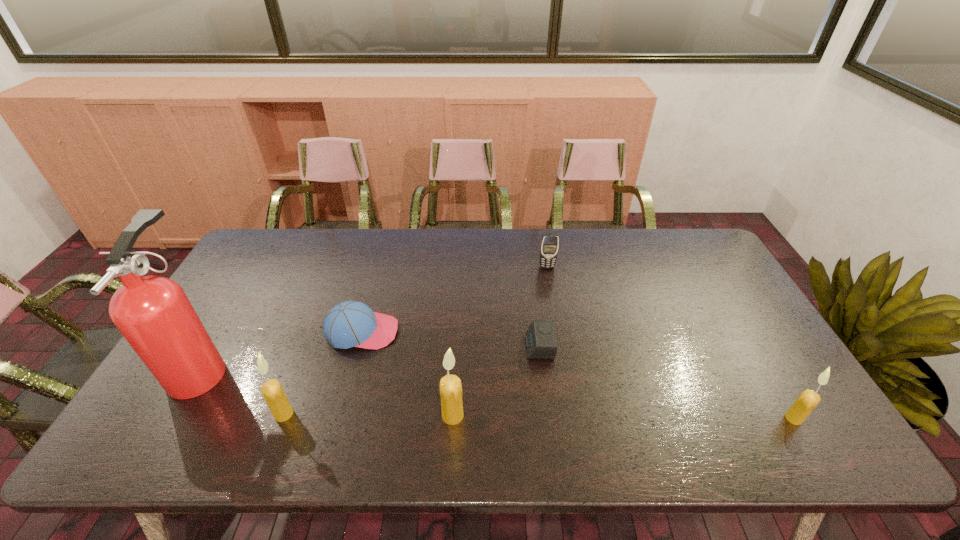
Image resolution: width=960 pixels, height=540 pixels. Identify the location of free space at the right edge. (743, 316).

The image size is (960, 540). In the image, there is a desktop. In order to click on free space at the far left corner in this screenshot , I will do `click(263, 239)`.

Identify the location of vacant space at the far right corner. (684, 238).

I want to click on empty space that is in between the fifth shortest object and the shortest candle, so click(x=539, y=416).

The image size is (960, 540). Find the location of `vacant space that's between the leftmost candle and the farthest object`. vacant space that's between the leftmost candle and the farthest object is located at coordinates (416, 340).

Locate an element on the screen. blank region between the shortest candle and the third shortest object is located at coordinates (670, 342).

Locate an element on the screen. This screenshot has height=540, width=960. vacant point located between the cellular telephone and the sixth tallest object is located at coordinates (454, 299).

The image size is (960, 540). In order to click on vacant area that lies between the rightmost candle and the sixth object from right to left in this screenshot , I will do `click(539, 416)`.

Where is `empty space between the baseball cap and the third shortest object`? The width and height of the screenshot is (960, 540). empty space between the baseball cap and the third shortest object is located at coordinates (454, 299).

At what (x,y) coordinates should I click in order to perform the action: click on vacant space in between the fourth object from left to right and the shortest object. Please return your answer as a coordinate pair (x, y). Image resolution: width=960 pixels, height=540 pixels. Looking at the image, I should click on (496, 381).